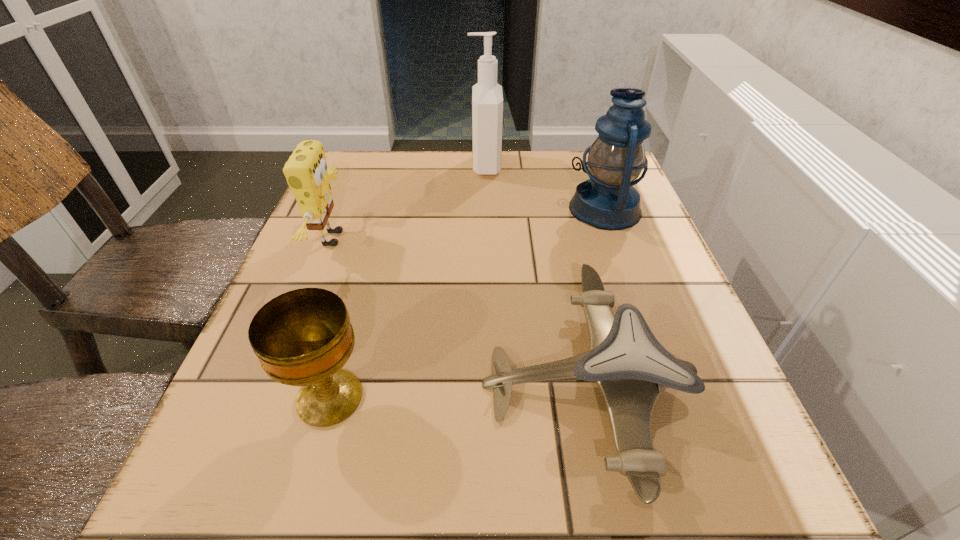
Find the location of a particular element. The width and height of the screenshot is (960, 540). vacant space located on the face of the lantern is located at coordinates (420, 209).

The height and width of the screenshot is (540, 960). Identify the location of vacant area located 0.080m on the face of the lantern. (535, 209).

The width and height of the screenshot is (960, 540). Find the location of `free space located on the face of the sponge`. free space located on the face of the sponge is located at coordinates (413, 239).

Where is `free location located on the back of the chalice`? Image resolution: width=960 pixels, height=540 pixels. free location located on the back of the chalice is located at coordinates (370, 257).

At what (x,y) coordinates should I click in order to perform the action: click on vacant region located 0.380m on the front-facing side of the drone. Please return your answer as a coordinate pair (x, y). The height and width of the screenshot is (540, 960). Looking at the image, I should click on (237, 384).

Where is `vacant space located on the front-facing side of the drone`? This screenshot has height=540, width=960. vacant space located on the front-facing side of the drone is located at coordinates (256, 384).

The height and width of the screenshot is (540, 960). In order to click on vacant space located on the front-facing side of the drone in this screenshot , I will do `click(444, 384)`.

At what (x,y) coordinates should I click in order to perform the action: click on cleansing agent that is at the far edge. Please return your answer as a coordinate pair (x, y). This screenshot has width=960, height=540. Looking at the image, I should click on (487, 97).

Locate an element on the screen. lantern positioned at the far edge is located at coordinates (608, 201).

This screenshot has height=540, width=960. In order to click on object that is positioned at the near edge in this screenshot , I will do `click(631, 368)`.